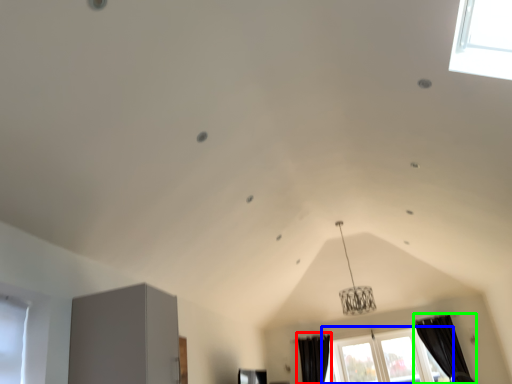
Question: Based on their relative distances, which object is farther from curtain (highlighted by a red box)? Choose from window (highlighted by a blue box) and curtain (highlighted by a green box).

Choices:
 (A) window
 (B) curtain

Answer: (B)